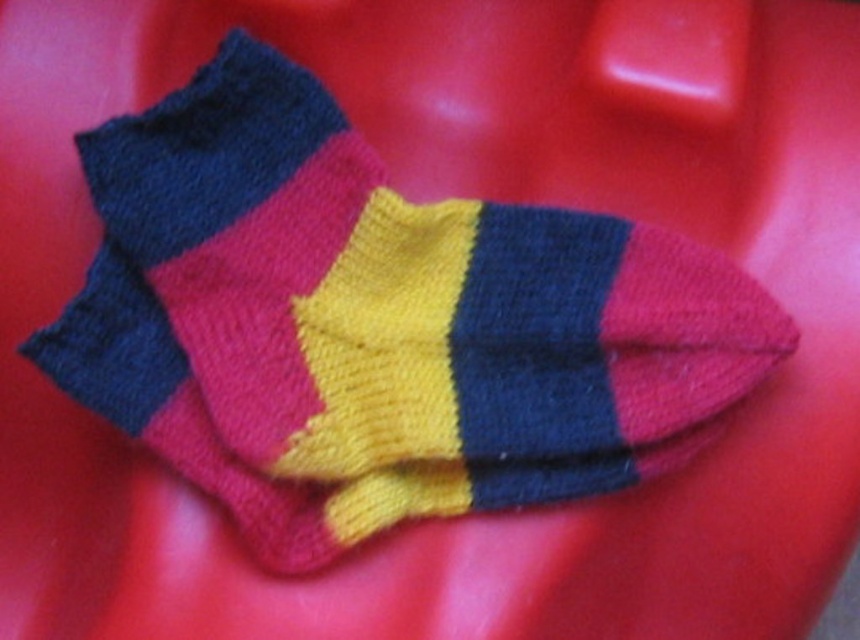
Is knitted wool socks at center shorter than knitted wool sock at center?

No, knitted wool socks at center is not shorter than knitted wool sock at center.

Which of these two, knitted wool socks at center or knitted wool sock at center, stands taller?

Standing taller between the two is knitted wool socks at center.

Is point (191, 349) farther from camera compared to point (382, 477)?

That is False.

Find the location of a particular element. The width and height of the screenshot is (860, 640). knitted wool socks at center is located at coordinates (395, 296).